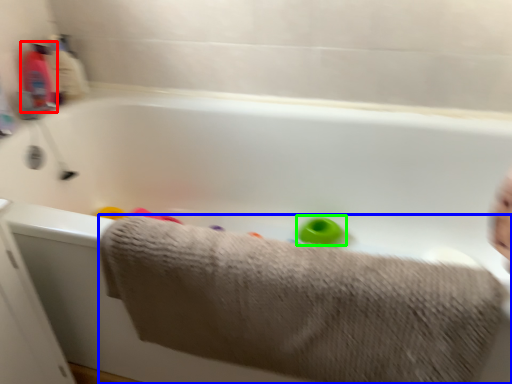
Question: Which object is the closest to the baby bottle (highlighted by a red box)? Choose among these: towel (highlighted by a blue box) or toy (highlighted by a green box).

Choices:
 (A) towel
 (B) toy

Answer: (B)